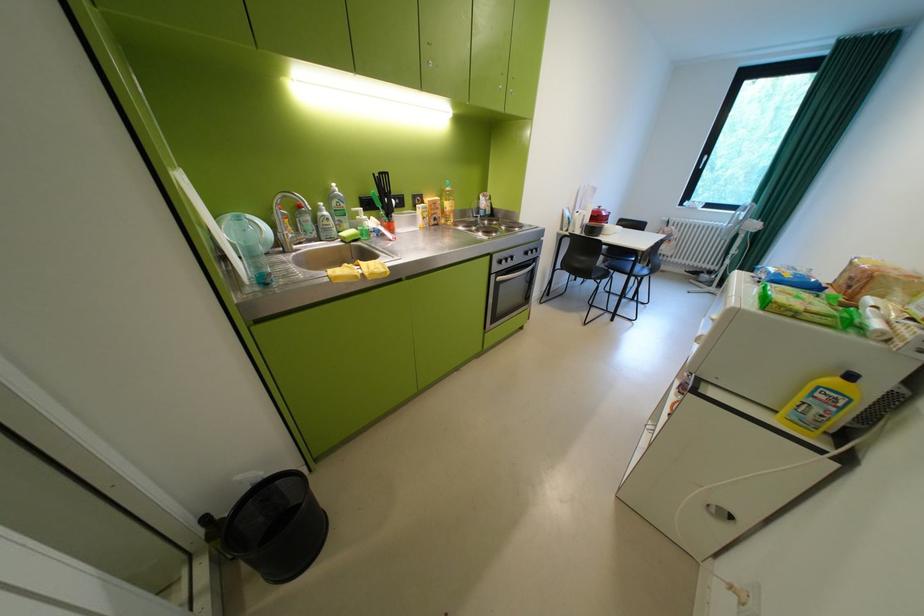
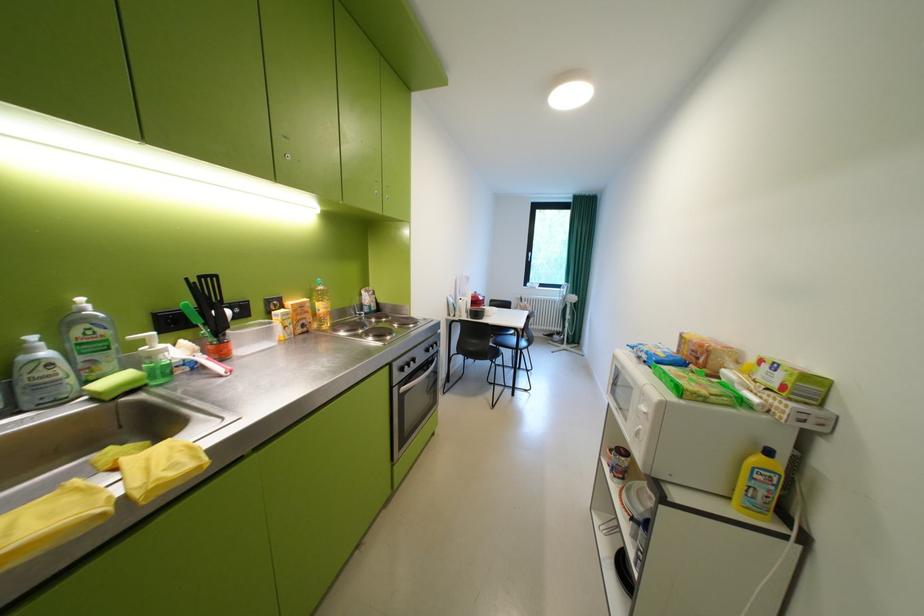
Question: Based on the continuous images, in which direction is the camera rotating? Reply with the corresponding letter.

Choices:
 (A) Left
 (B) Right
 (C) Up
 (D) Down

Answer: (B)